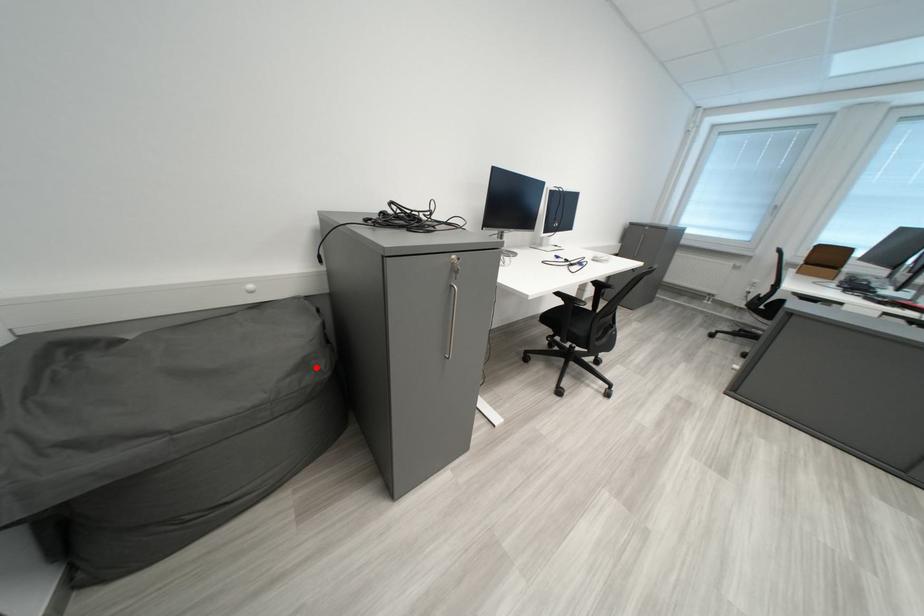
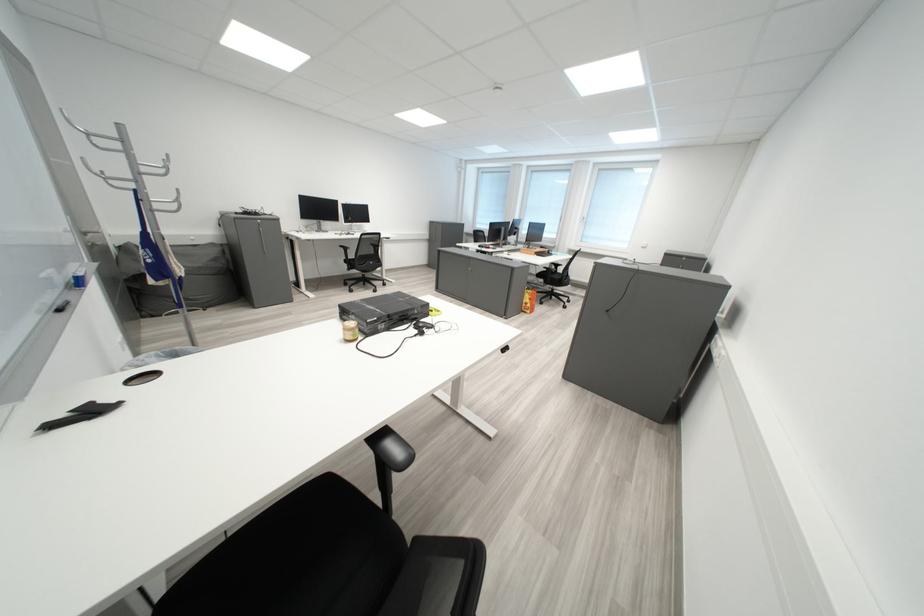
The point at the highlighted location is marked in the first image. Where is the corresponding point in the second image?

(228, 262)